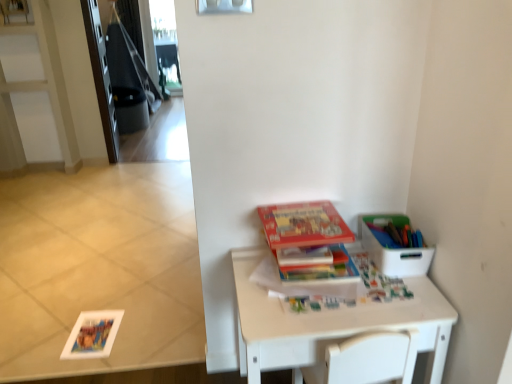
Image resolution: width=512 pixels, height=384 pixels. I want to click on vacant area that is in front of hardcover book at center, which is the 1th paperback book in bottom-to-top order, so click(328, 316).